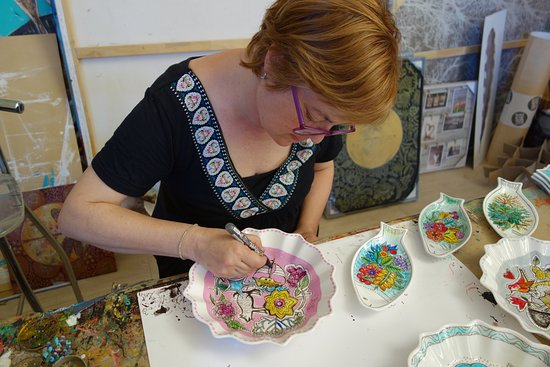
Locate an element on the screen. The height and width of the screenshot is (367, 550). pottery is located at coordinates (258, 300), (401, 265), (444, 230), (507, 212), (522, 287), (484, 341).